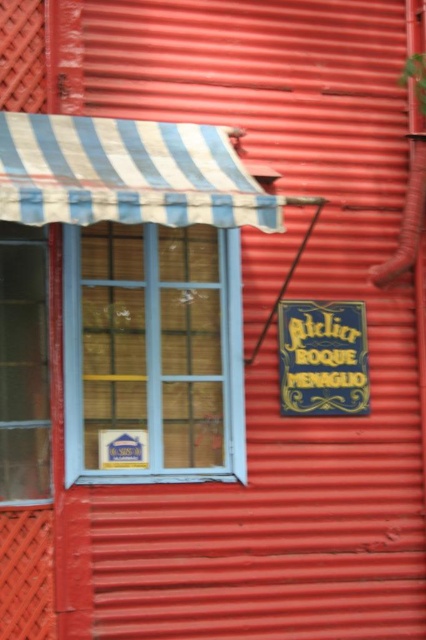
Does clear glass window at left appear on the right side of blue painted wood sign at center right?

Incorrect, clear glass window at left is not on the right side of blue painted wood sign at center right.

Find the location of `clear glass window at left`. clear glass window at left is located at coordinates (23, 364).

Who is more distant from viewer, (138,481) or (347,388)?

The point (347,388) is behind.

Between blue painted wood window at center and blue painted wood sign at center right, which one is positioned higher?

blue painted wood window at center is higher up.

The height and width of the screenshot is (640, 426). I want to click on blue painted wood window at center, so click(x=152, y=355).

Is blue painted wood window at center wider than clear glass window at left?

Indeed, blue painted wood window at center has a greater width compared to clear glass window at left.

The image size is (426, 640). I want to click on blue painted wood window at center, so click(152, 355).